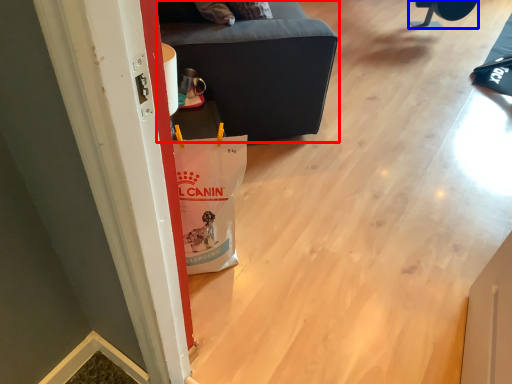
Question: Which point is further to the camera, furniture (highlighted by a red box) or furniture (highlighted by a blue box)?

Choices:
 (A) furniture
 (B) furniture

Answer: (B)